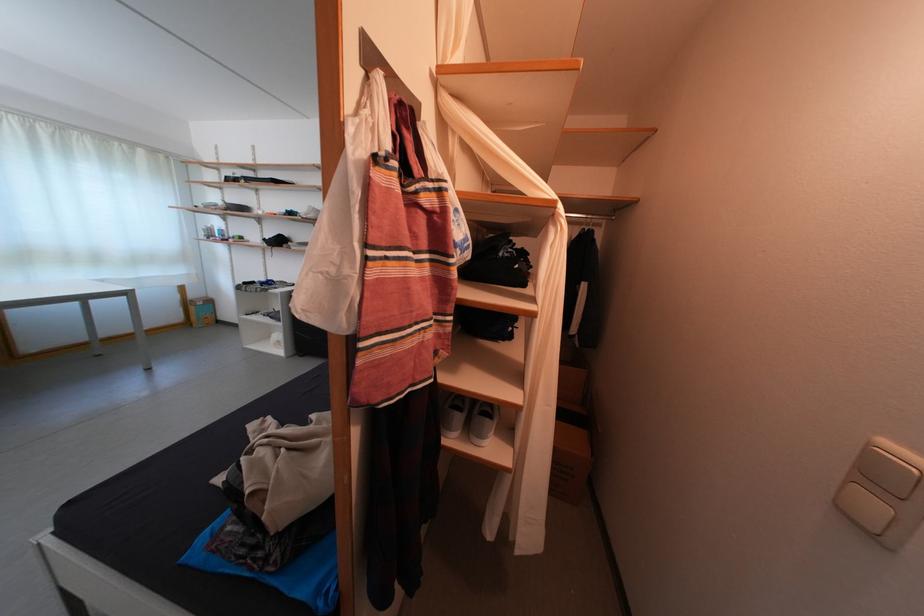
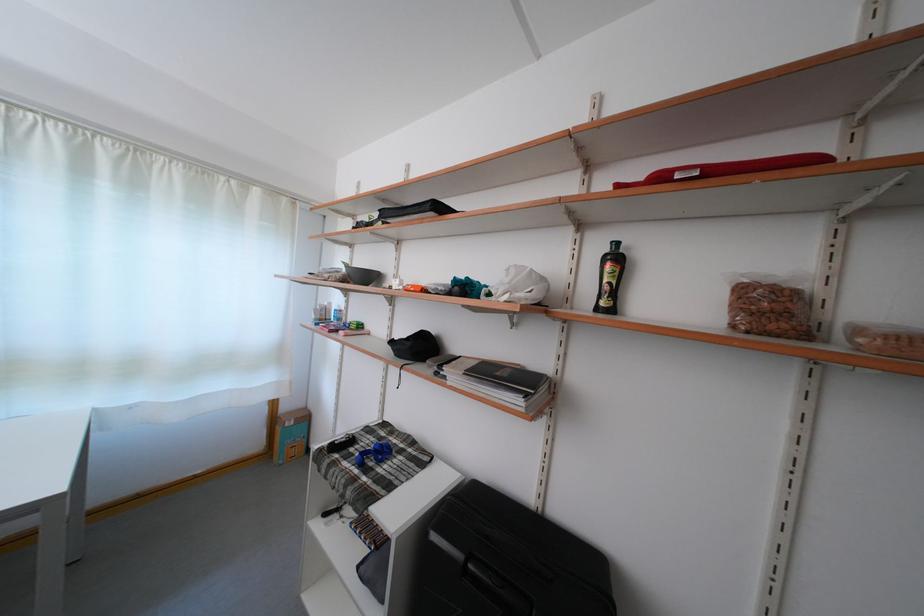
In the second image, find the point that corresponds to the point at 201,302 in the first image.

(293, 415)